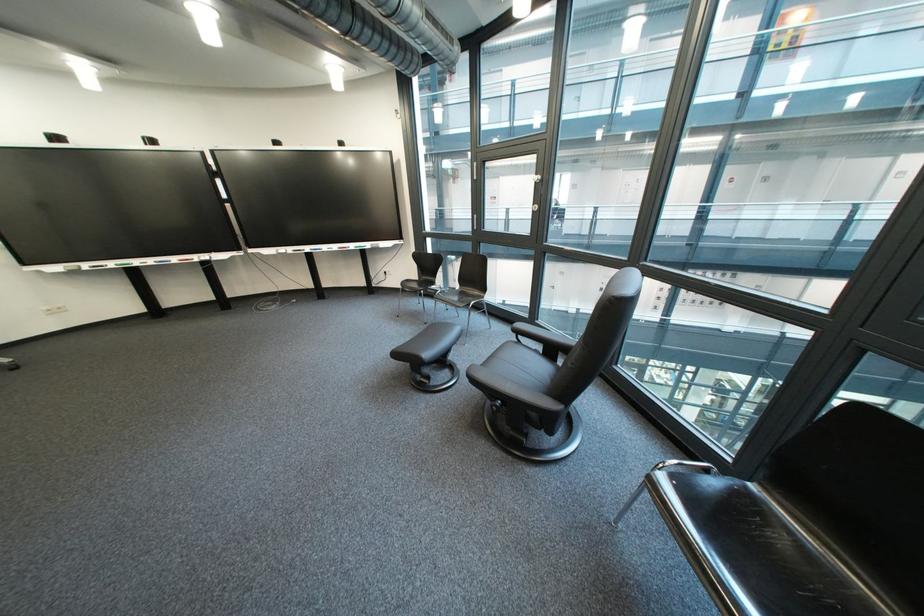
This screenshot has width=924, height=616. What are the coordinates of `black chair sitting surface` in the screenshot? It's located at (686, 312).